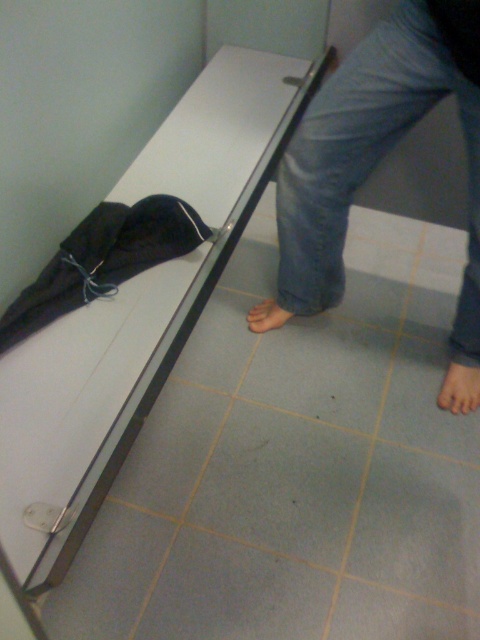
Question: Which point appears closest to the camera in this image?

Choices:
 (A) (441, 390)
 (B) (271, 300)
 (C) (325, 236)

Answer: (C)

Question: Among these objects, which one is farthest from the camera?

Choices:
 (A) brown matte foot at lower center
 (B) pinkish matte skin at lower right

Answer: (A)

Question: Is denim pants at lower right positioned behind pinkish matte skin at lower right?

Choices:
 (A) yes
 (B) no

Answer: (B)

Question: Does denim pants at lower right lie in front of pinkish matte skin at lower right?

Choices:
 (A) no
 (B) yes

Answer: (B)

Question: Which point is farther to the camera?

Choices:
 (A) pinkish matte skin at lower right
 (B) denim pants at lower right

Answer: (A)

Question: Considering the relative positions of pinkish matte skin at lower right and brown matte foot at lower center in the image provided, where is pinkish matte skin at lower right located with respect to brown matte foot at lower center?

Choices:
 (A) below
 (B) above

Answer: (A)